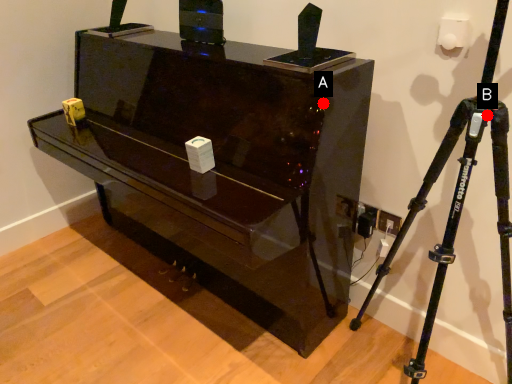
Question: Two points are circled on the image, labeled by A and B beside each circle. Which point is farther from the camera taking this photo?

Choices:
 (A) A is further
 (B) B is further

Answer: (A)